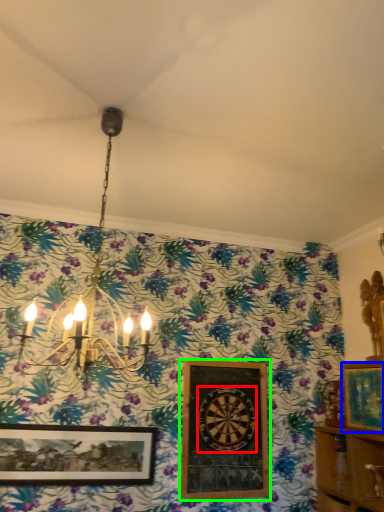
Question: Considering the real-world distances, which object is farthest from design (highlighted by a red box)? picture frame (highlighted by a blue box) or picture frame (highlighted by a green box)?

Choices:
 (A) picture frame
 (B) picture frame

Answer: (A)